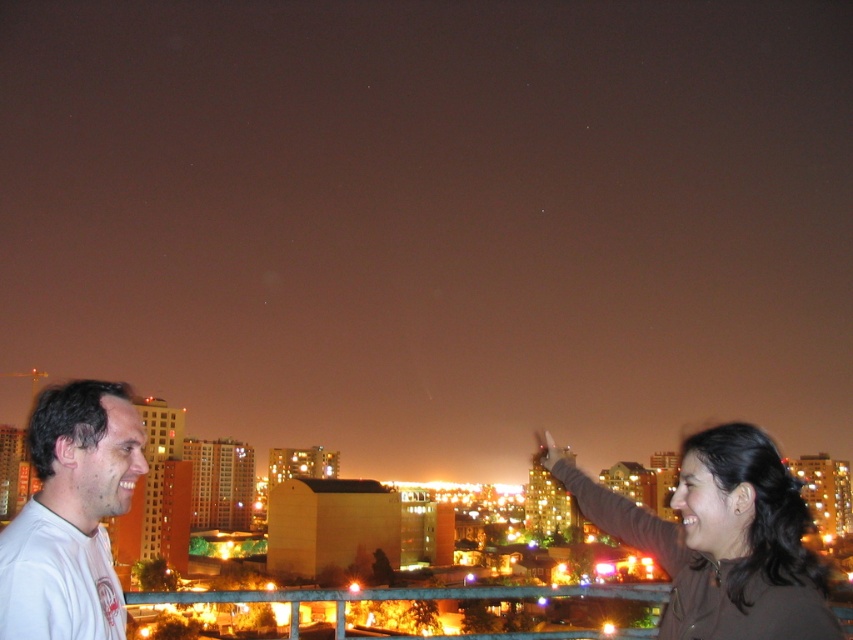
You are standing on a rooftop and see the point at coordinates (718, 540). What object is located at that point?

The point at coordinates (718, 540) corresponds to the brown matte jacket at upper right.